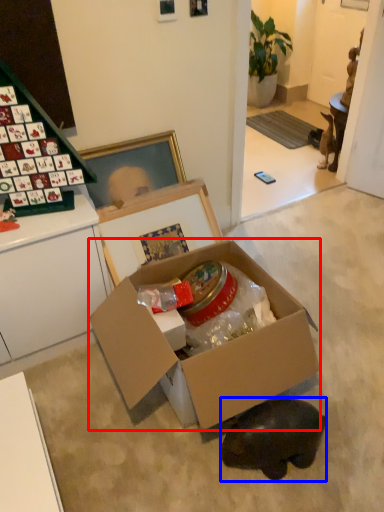
Question: Among these objects, which one is nearest to the camera, box (highlighted by a red box) or animal (highlighted by a blue box)?

Choices:
 (A) box
 (B) animal

Answer: (A)